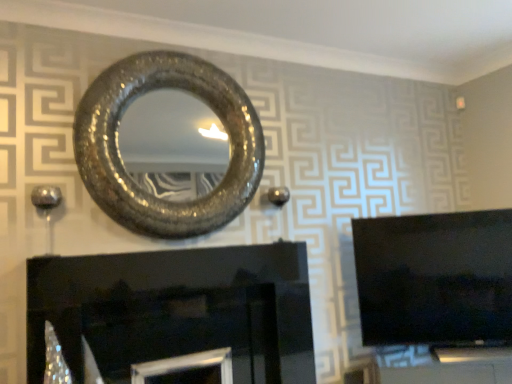
Question: Is point (253, 177) positioned closer to the camera than point (172, 276)?

Choices:
 (A) farther
 (B) closer

Answer: (A)

Question: From the image's perspective, relative to black glossy fireplace at lower center, is shiny metallic mirror at upper center above or below?

Choices:
 (A) above
 (B) below

Answer: (A)

Question: Estimate the real-world distances between objects in this image. Which object is farther from the black glossy tv at right?

Choices:
 (A) shiny metallic mirror at upper center
 (B) black glossy fireplace at lower center

Answer: (A)

Question: Which object is positioned closest to the black glossy tv at right?

Choices:
 (A) shiny metallic mirror at upper center
 (B) black glossy fireplace at lower center

Answer: (B)